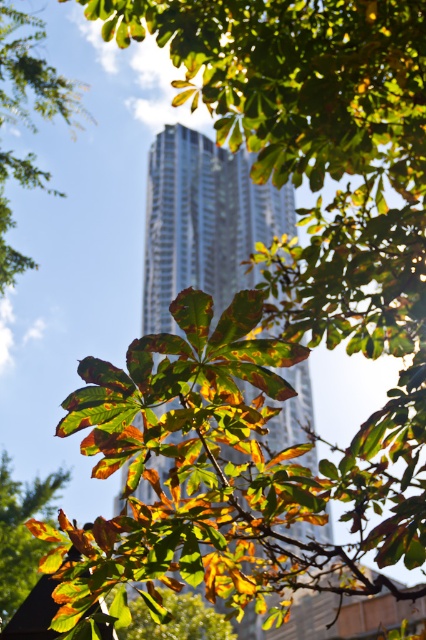
Question: Considering the real-world distances, which object is closest to the leaves at center?

Choices:
 (A) autumn leaves at center
 (B) green leafy tree at upper left
 (C) silver metallic tower at center

Answer: (A)

Question: Does autumn leaves at center appear under leaves at center?

Choices:
 (A) no
 (B) yes

Answer: (B)

Question: Does silver metallic tower at center lie in front of green leafy tree at upper left?

Choices:
 (A) yes
 (B) no

Answer: (A)

Question: Is autumn leaves at center smaller than leaves at center?

Choices:
 (A) yes
 (B) no

Answer: (A)

Question: Which object is the farthest from the silver metallic tower at center?

Choices:
 (A) autumn leaves at center
 (B) green leafy tree at upper left

Answer: (B)

Question: Which point is closer to the camera taking this photo?

Choices:
 (A) (0, 513)
 (B) (210, 196)
 (C) (135, 620)
 (D) (31, 80)

Answer: (D)